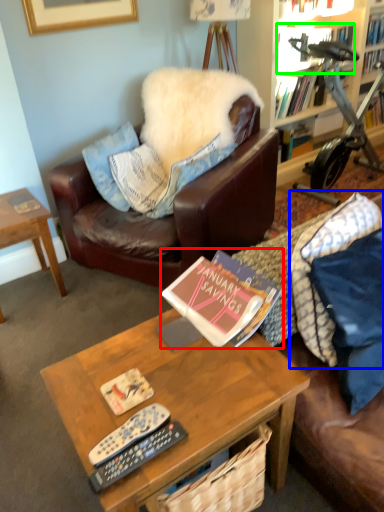
Question: Which is farther away from book (highlighted by a red box)? pillow (highlighted by a blue box) or book (highlighted by a green box)?

Choices:
 (A) pillow
 (B) book

Answer: (B)